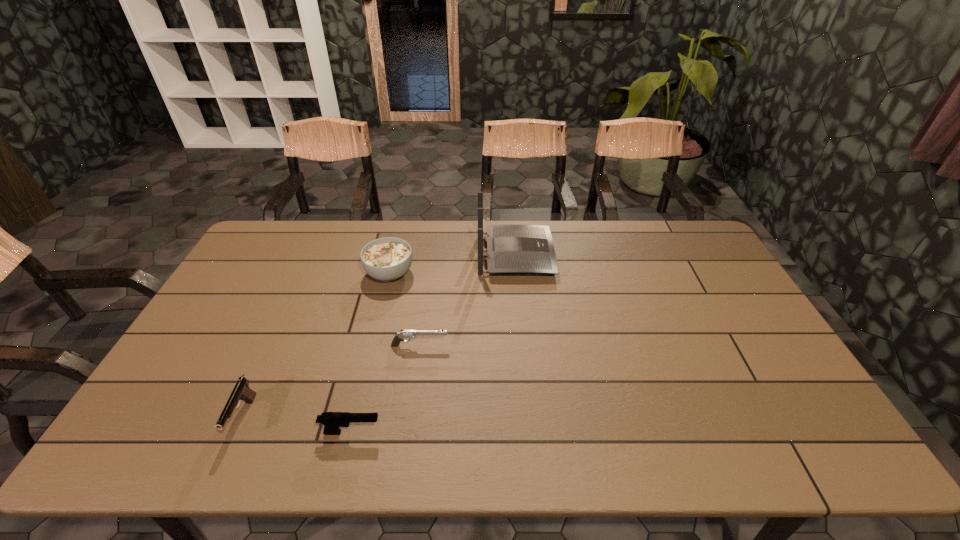
Identify the location of free space between the leftmost pistol and the soup bowl. (317, 346).

Locate an element on the screen. The image size is (960, 540). vacant area between the shortest object and the leftmost pistol is located at coordinates (331, 382).

You are a GUI agent. You are given a task and a screenshot of the screen. Output one action in this format:
    pyautogui.click(x=<x>, y=<y>)
    Task: Click on the object that stands as the second closest to the tallest object
    The height and width of the screenshot is (540, 960).
    Given the screenshot: What is the action you would take?
    pyautogui.click(x=404, y=334)

Identify the location of object that is the third nearest to the leftmost pistol. (387, 259).

Where is `pistol identified as the closest to the shortest pistol`? The image size is (960, 540). pistol identified as the closest to the shortest pistol is located at coordinates click(x=332, y=421).

Choose which pistol is the third nearest neighbor to the soup bowl. Please provide its 2D coordinates. Your answer should be formatted as a tuple, i.e. [(x, y)], where the tuple contains the x and y coordinates of a point satisfying the conditions above.

[(332, 421)]

Image resolution: width=960 pixels, height=540 pixels. Find the location of `blank space that satisfies the following two spatial constraints: 1. on the front-facing side of the third nearest object; 2. at the muzzle of the leftmost pistol`. blank space that satisfies the following two spatial constraints: 1. on the front-facing side of the third nearest object; 2. at the muzzle of the leftmost pistol is located at coordinates (410, 418).

Where is `free space that satisfies the following two spatial constraints: 1. on the front-facing side of the shortest pistol; 2. at the muzzle of the leftmost pistol`? Image resolution: width=960 pixels, height=540 pixels. free space that satisfies the following two spatial constraints: 1. on the front-facing side of the shortest pistol; 2. at the muzzle of the leftmost pistol is located at coordinates click(x=410, y=418).